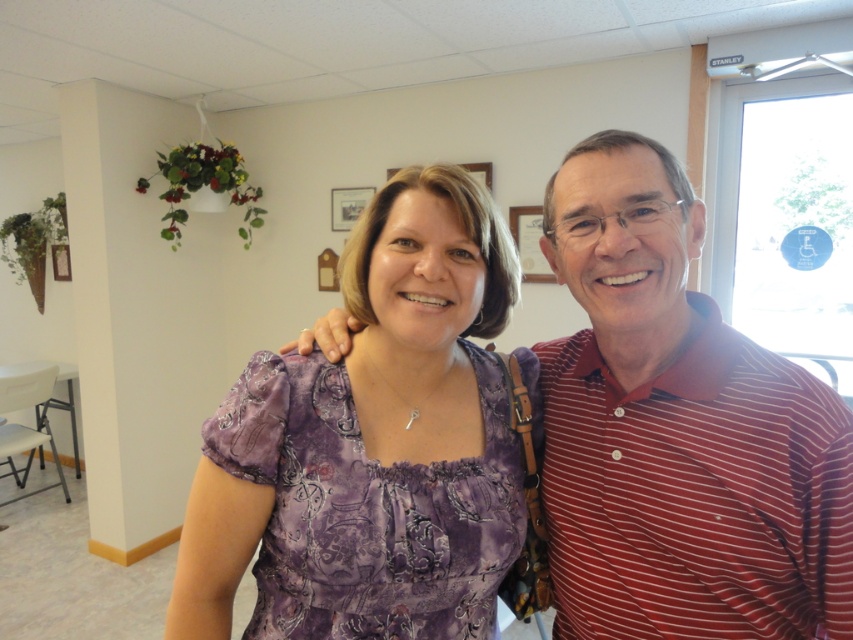
You are organizing a photoshoot and need to arrange two outfits for a magazine spread. The outfits are the striped cotton shirt at right and the purple printed dress at center. Based on their positions in the image, which outfit is located to the left of the other?

The purple printed dress at center is positioned to the left of the striped cotton shirt at right.

You are a photographer setting up for a group photo. You need to position the striped cotton shirt at right and the purple printed dress at center so that both are visible in the frame. Based on their current positions, which object is higher in the image?

The striped cotton shirt at right is above the purple printed dress at center, so it is higher in the image.

You are organizing a photo shoot and need to ensure that the striped cotton shirt at right and the purple printed dress at center fit within a rectangular frame. Based on their widths, which item will require more horizontal space in the frame?

The purple printed dress at center requires more horizontal space because it has a greater width than the striped cotton shirt at right.